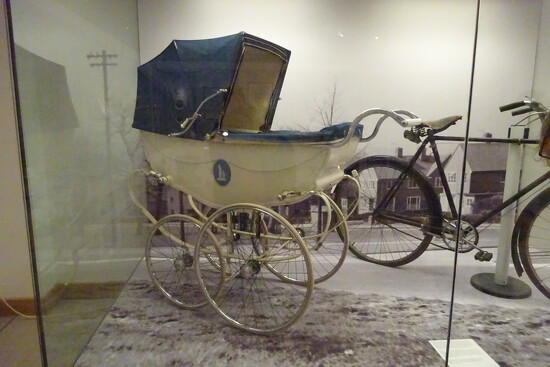
At what (x,y) coordinates should I click in order to perform the action: click on floor. Please return your answer as a coordinate pair (x, y). This screenshot has width=550, height=367. Looking at the image, I should click on (157, 335).